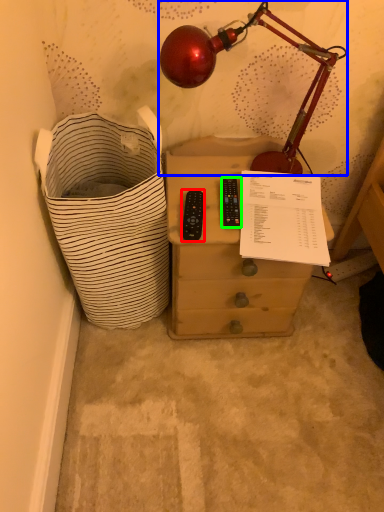
Question: Based on their relative distances, which object is nearer to control (highlighted by a red box)? Choose from lamp (highlighted by a blue box) and control (highlighted by a green box).

Choices:
 (A) lamp
 (B) control

Answer: (B)